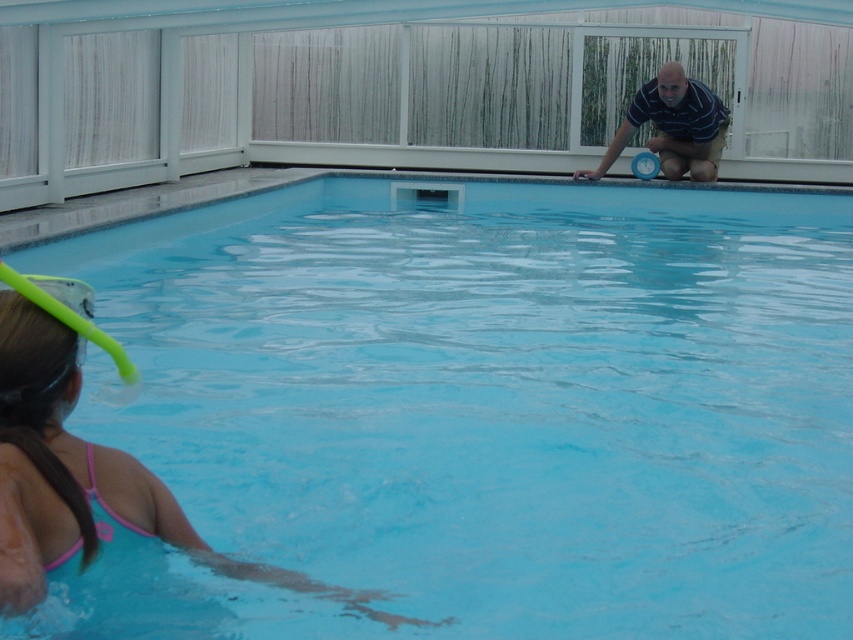
Which of these two, pink fabric swimwear at lower left or striped cotton shirt at upper right, stands shorter?

pink fabric swimwear at lower left

This screenshot has width=853, height=640. Find the location of `pink fabric swimwear at lower left`. pink fabric swimwear at lower left is located at coordinates pos(86,477).

Does transparent glass swimming pool at center appear over striped cotton shirt at upper right?

No.

Does point (399, 634) come behind point (640, 104)?

No, it is not.

Locate an element on the screen. The width and height of the screenshot is (853, 640). transparent glass swimming pool at center is located at coordinates (500, 394).

Does transparent glass swimming pool at center lie behind pink fabric swimwear at lower left?

Yes, it is.

Does point (22, 253) come in front of point (54, 404)?

No, it is behind (54, 404).

Locate an element on the screen. transparent glass swimming pool at center is located at coordinates (500, 394).